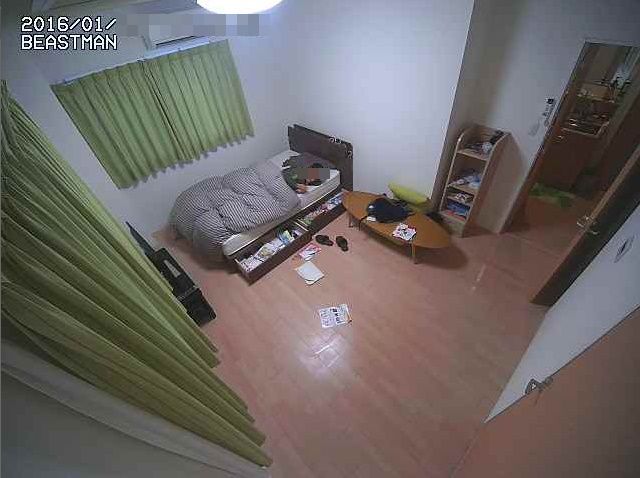
Find the location of a particular element. The height and width of the screenshot is (478, 640). gray headboard is located at coordinates pyautogui.click(x=324, y=149).